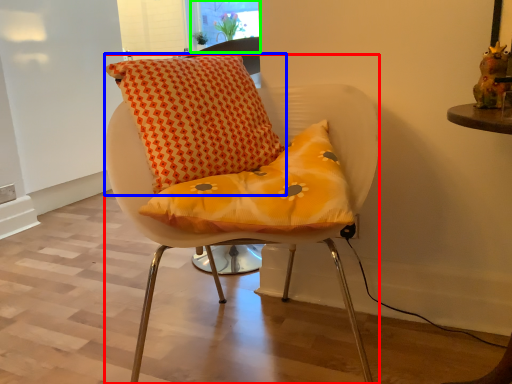
Question: Which is nearer to the chair (highlighted by a red box)? pillow (highlighted by a blue box) or window screen (highlighted by a green box).

Choices:
 (A) pillow
 (B) window screen

Answer: (A)